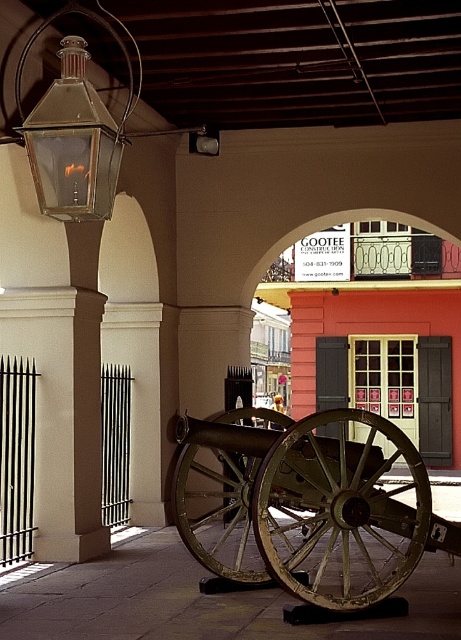
Question: Can you confirm if rusty metal cannon at center is bigger than metallic glass lantern at upper center?

Choices:
 (A) no
 (B) yes

Answer: (B)

Question: Is rusty metal cannon at center thinner than metallic glass lantern at upper center?

Choices:
 (A) no
 (B) yes

Answer: (A)

Question: Which object is positioned closest to the rusty metal cannon at center?

Choices:
 (A) metallic glass lantern at upper center
 (B) matte glass lantern at upper left

Answer: (B)

Question: Among these points, which one is nearest to the camera?

Choices:
 (A) (206, 138)
 (B) (370, 512)
 (C) (112, 172)

Answer: (C)

Question: Which object is farther from the camera taking this photo?

Choices:
 (A) rusty metal cannon at center
 (B) matte glass lantern at upper left
 (C) metallic glass lantern at upper center

Answer: (C)

Question: Is matte glass lantern at upper left wider than metallic glass lantern at upper center?

Choices:
 (A) yes
 (B) no

Answer: (A)